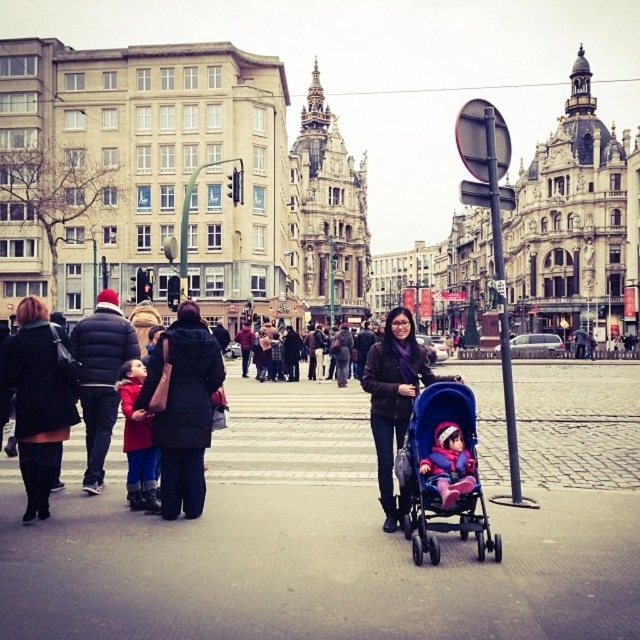
Consider the image. Is matte black coat at center closer to camera compared to dark gray fabric crowd at center?

Yes, it is in front of dark gray fabric crowd at center.

Is point (388, 449) farther from viewer compared to point (280, 358)?

No, it is in front of (280, 358).

What are the coordinates of `matte black coat at center` in the screenshot? It's located at (394, 401).

Between blue plastic stroller at center and matte pink fabric baby carriage at center, which one appears on the left side from the viewer's perspective?

Positioned to the left is matte pink fabric baby carriage at center.

Is blue plastic stroller at center shorter than matte pink fabric baby carriage at center?

No.

Is point (435, 403) closer to viewer compared to point (440, 464)?

No, (435, 403) is further to viewer.

Locate an element on the screen. The height and width of the screenshot is (640, 640). blue plastic stroller at center is located at coordinates (444, 472).

Between blue plastic stroller at center and matte black coat at center, which one has more height?

With more height is matte black coat at center.

Is blue plastic stroller at center behind matte black coat at center?

No, it is not.

Describe the element at coordinates (444, 472) in the screenshot. I see `blue plastic stroller at center` at that location.

The image size is (640, 640). What are the coordinates of `blue plastic stroller at center` in the screenshot? It's located at (444, 472).